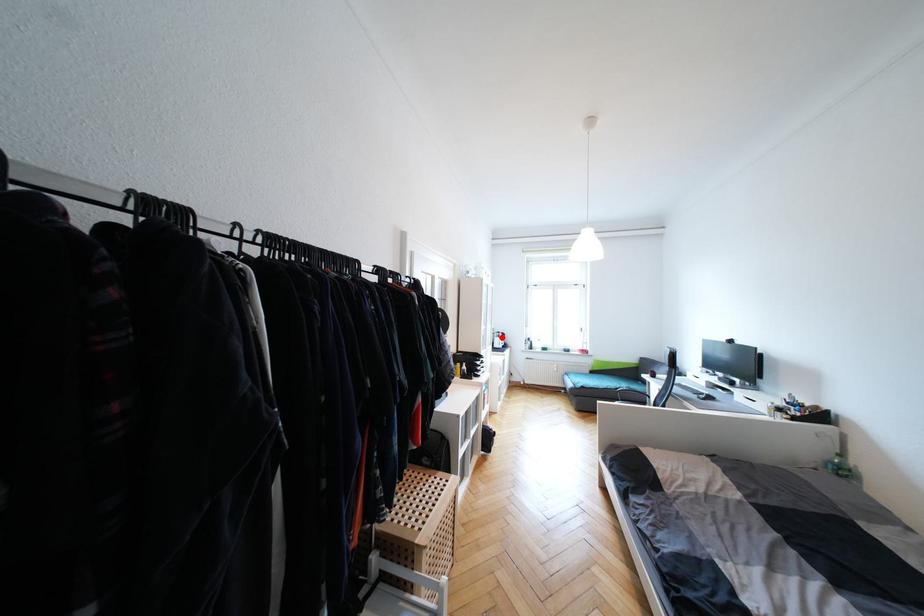
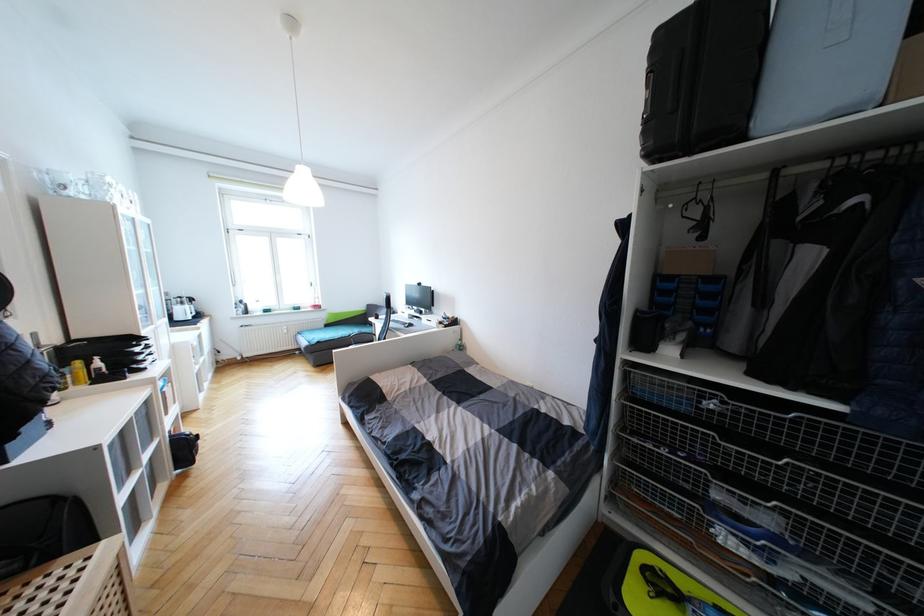
Question: I am providing you with two images of the same scene from different viewpoints. In image1, a red point is highlighted. Considering the same 3D point in image2, which of the following is correct?

Choices:
 (A) It is closer
 (B) It is farther

Answer: (A)